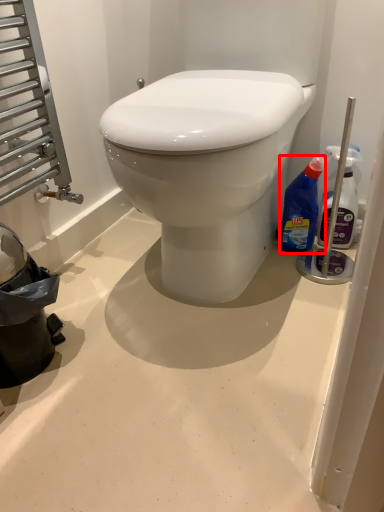
Question: From the image's perspective, where is bottle (annotated by the red box) located relative to bottle?

Choices:
 (A) above
 (B) below

Answer: (B)